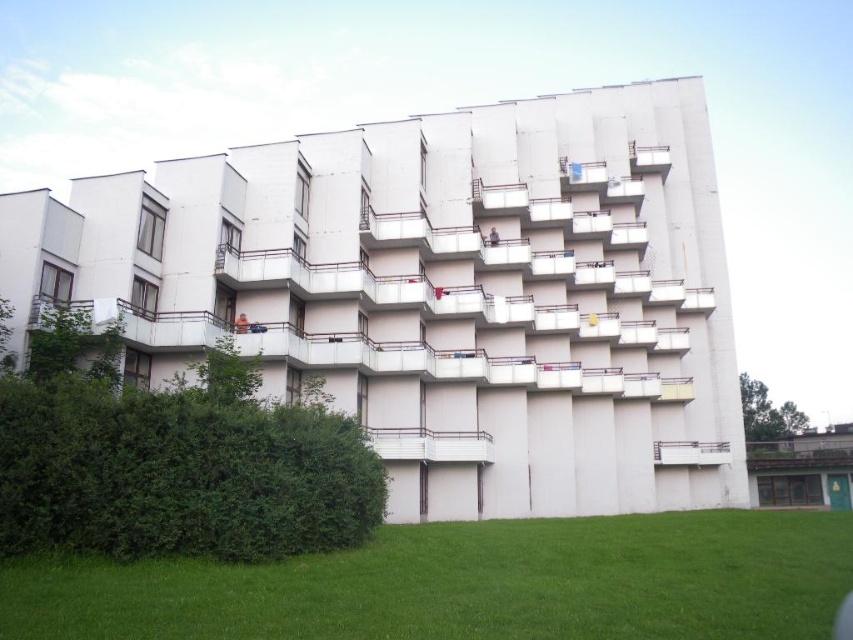
You are standing in front of the residential building and want to walk towards the green grass at lower center. Which direction should you move relative to the white concrete balcony at center?

To reach the green grass at lower center, you should move to the left side of the white concrete balcony at center since the green grass at lower center is located to the left of it.

You are standing in front of the residential building and want to take a photo that includes both point (210, 618) and point (398, 452). Since you want to ensure both points are in focus, which point should you focus on to maximize the depth of field?

You should focus on point (210, 618) because it is closer to the camera than point (398, 452). Focusing on the closer point helps ensure both points are within the depth of field.